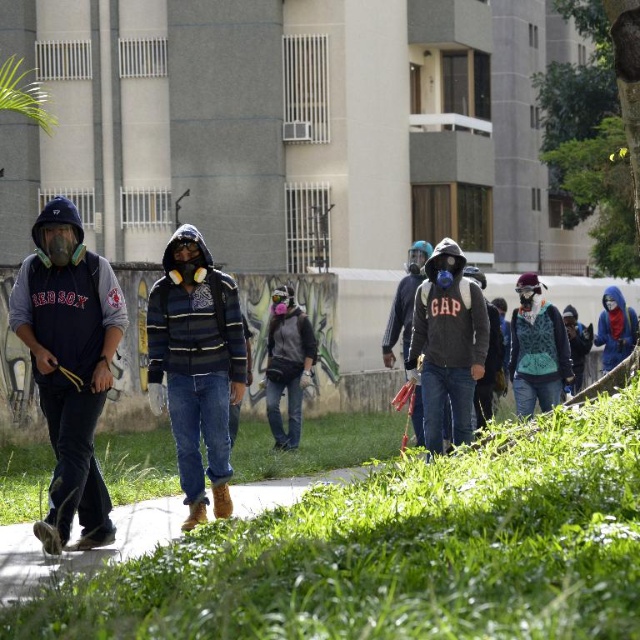
Question: In this image, where is gray matte jacket at center located relative to matte gray jacket at center?

Choices:
 (A) above
 (B) below

Answer: (B)

Question: Which object appears farthest from the camera in this image?

Choices:
 (A) matte gray jacket at center
 (B) matte black hoodie at left
 (C) teal knitted vest at center
 (D) gray matte jacket at center

Answer: (D)

Question: Does matte black hoodie at left have a greater width compared to matte gray jacket at center?

Choices:
 (A) no
 (B) yes

Answer: (A)

Question: Which is farther from the gray matte jacket at center?

Choices:
 (A) matte black hoodie at left
 (B) blue matte jacket at right
 (C) matte gray jacket at center

Answer: (A)

Question: Does matte black hoodie at left appear under gray matte jacket at center?

Choices:
 (A) no
 (B) yes

Answer: (A)

Question: Which point appears farthest from the camera in this image?

Choices:
 (A) (618, 358)
 (B) (384, 336)
 (C) (93, 531)

Answer: (A)